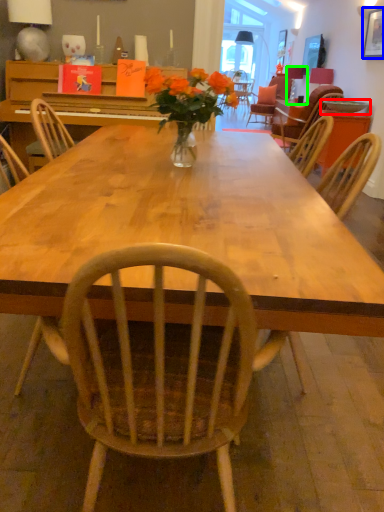
Question: Estimate the real-world distances between objects in this image. Which object is closer to bowl (highlighted by a red box), painting (highlighted by a blue box) or lamp (highlighted by a green box)?

Choices:
 (A) painting
 (B) lamp

Answer: (A)